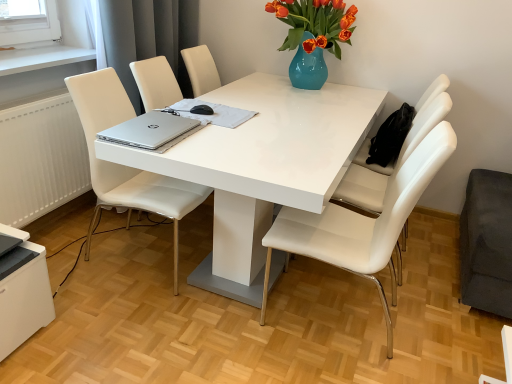
Image resolution: width=512 pixels, height=384 pixels. I want to click on free space to the left of white leather chair at right, which ranks as the second chair in left-to-right order, so click(217, 332).